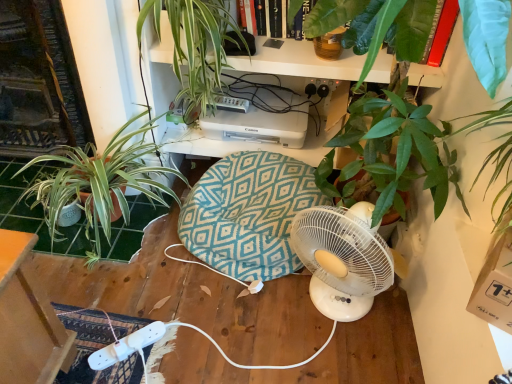
Find the location of a particular element. This screenshot has width=512, height=384. vacant space in front of teal fabric swivel chair at center is located at coordinates (232, 334).